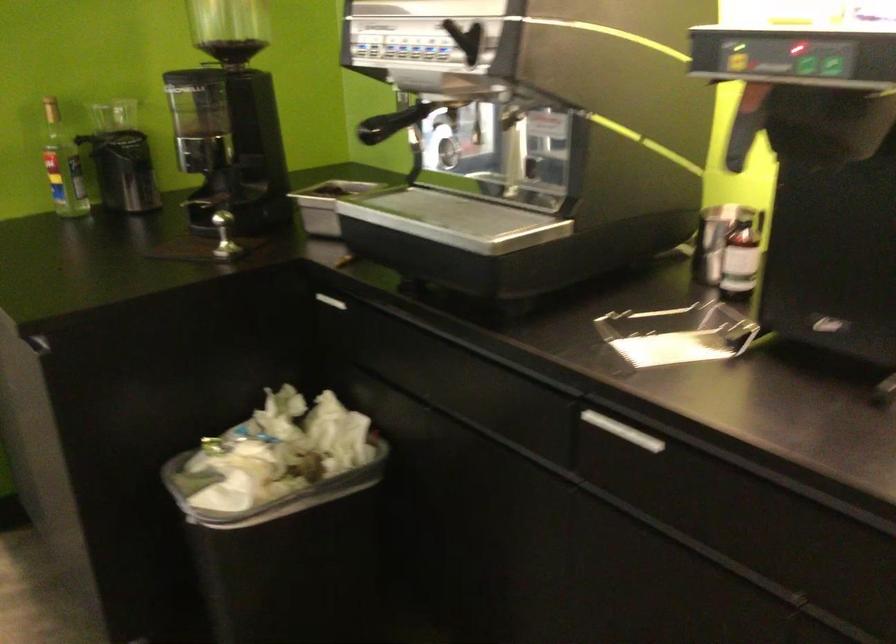
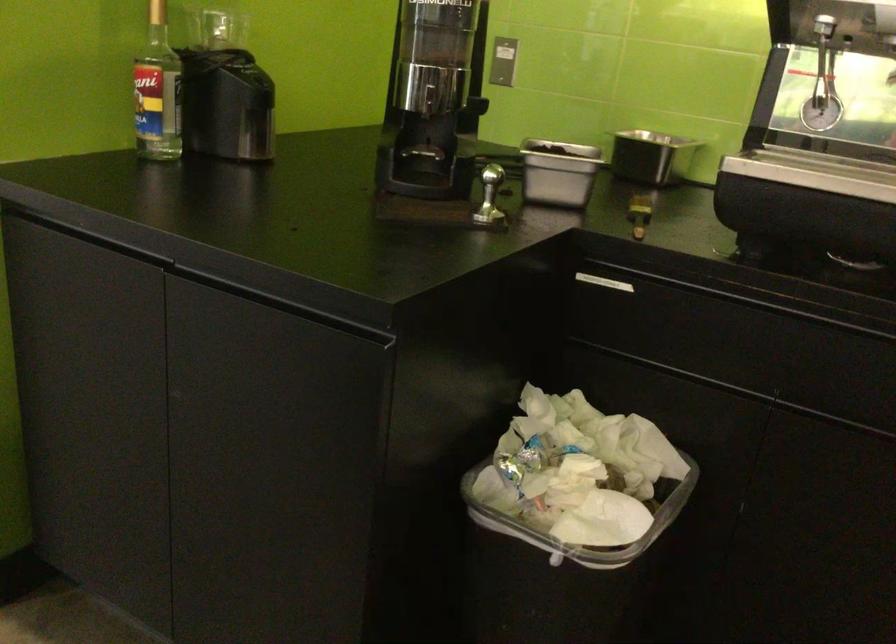
In a continuous first-person perspective shot, in which direction is the camera moving?

The cameraman moved toward left, forward.